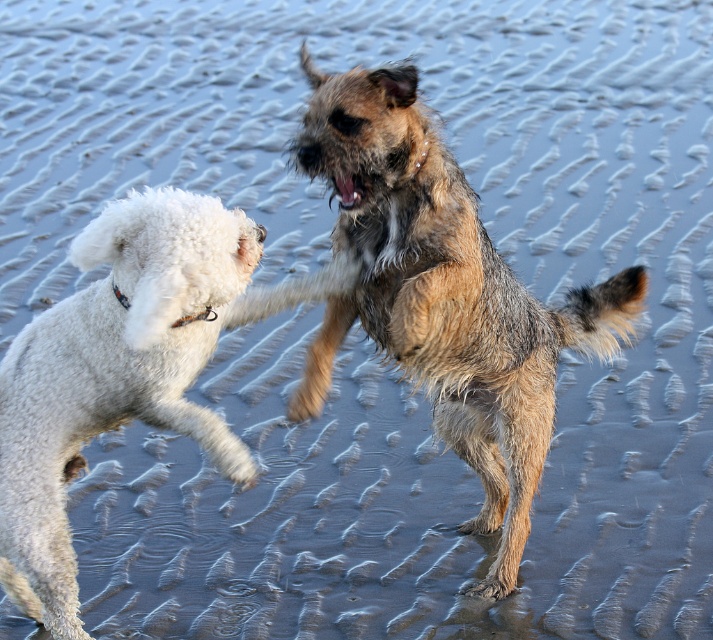
Question: In this image, where is shaggy brown dog at center located relative to white fluffy dog at left?

Choices:
 (A) below
 (B) above

Answer: (B)

Question: Does shaggy brown dog at center appear on the right side of white fluffy dog at left?

Choices:
 (A) no
 (B) yes

Answer: (B)

Question: Which of the following is the farthest from the observer?

Choices:
 (A) (41, 595)
 (B) (548, 413)

Answer: (B)

Question: Observing the image, what is the correct spatial positioning of shaggy brown dog at center in reference to white fluffy dog at left?

Choices:
 (A) right
 (B) left

Answer: (A)